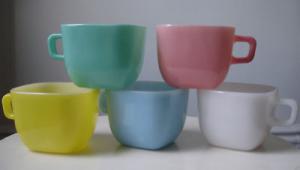
You are a GUI agent. You are given a task and a screenshot of the screen. Output one action in this format:
    pyautogui.click(x=<x>, y=<y>)
    Task: Click on the light green cup
    
    Given the screenshot: What is the action you would take?
    pyautogui.click(x=94, y=58)